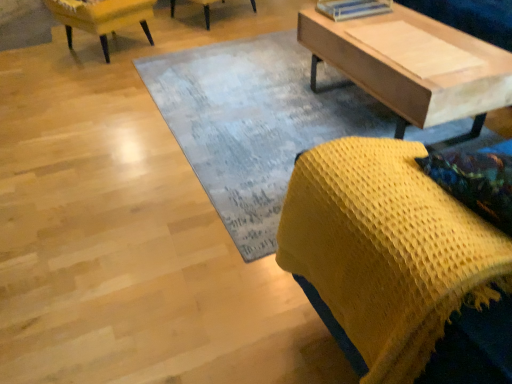
Question: Is yellow knitted blanket at lower right, the 2th chair positioned from the back, oriented towards light wood coffee table at upper right?

Choices:
 (A) no
 (B) yes

Answer: (A)

Question: Is yellow knitted blanket at lower right, the 2th chair positioned from the back, thinner than light wood coffee table at upper right?

Choices:
 (A) no
 (B) yes

Answer: (B)

Question: From a real-world perspective, is yellow knitted blanket at lower right, the 1th chair from the bottom, below light wood coffee table at upper right?

Choices:
 (A) no
 (B) yes

Answer: (A)

Question: From a real-world perspective, is yellow knitted blanket at lower right, the first chair in the right-to-left sequence, over light wood coffee table at upper right?

Choices:
 (A) no
 (B) yes

Answer: (B)

Question: Is yellow knitted blanket at lower right, the first chair in the right-to-left sequence, bigger than light wood coffee table at upper right?

Choices:
 (A) no
 (B) yes

Answer: (A)

Question: Is point (292, 66) closer or farther from the camera than point (504, 235)?

Choices:
 (A) closer
 (B) farther

Answer: (B)

Question: Considering the positions of textured gray rug at center and yellow knitted blanket at lower right, which appears as the 2th chair when viewed from the left, in the image, is textured gray rug at center wider or thinner than yellow knitted blanket at lower right, which appears as the 2th chair when viewed from the left,?

Choices:
 (A) thin
 (B) wide

Answer: (B)

Question: In the image, is textured gray rug at center positioned in front of or behind yellow knitted blanket at lower right, which appears as the 2th chair when viewed from the left?

Choices:
 (A) behind
 (B) front

Answer: (A)

Question: Is textured gray rug at center spatially inside yellow knitted blanket at lower right, arranged as the 1th chair when viewed from the front, or outside of it?

Choices:
 (A) outside
 (B) inside

Answer: (A)

Question: Considering the positions of yellow knitted blanket at lower right, the 2th chair positioned from the back, and textured gray rug at center in the image, is yellow knitted blanket at lower right, the 2th chair positioned from the back, wider or thinner than textured gray rug at center?

Choices:
 (A) thin
 (B) wide

Answer: (A)

Question: Based on their sizes in the image, would you say yellow knitted blanket at lower right, arranged as the 1th chair when viewed from the front, is bigger or smaller than textured gray rug at center?

Choices:
 (A) big
 (B) small

Answer: (B)

Question: Considering the relative positions of yellow knitted blanket at lower right, the first chair in the right-to-left sequence, and textured gray rug at center in the image provided, is yellow knitted blanket at lower right, the first chair in the right-to-left sequence, to the left or to the right of textured gray rug at center?

Choices:
 (A) left
 (B) right

Answer: (B)

Question: Is yellow knitted blanket at lower right, the 2th chair positioned from the back, inside the boundaries of textured gray rug at center, or outside?

Choices:
 (A) outside
 (B) inside

Answer: (A)

Question: In the image, is textured gray rug at center on the left side or the right side of yellow fabric chair at upper left, marked as the 2th chair in a bottom-to-top arrangement?

Choices:
 (A) left
 (B) right

Answer: (B)

Question: Is textured gray rug at center in front of or behind yellow fabric chair at upper left, marked as the 2th chair in a bottom-to-top arrangement, in the image?

Choices:
 (A) front
 (B) behind

Answer: (A)